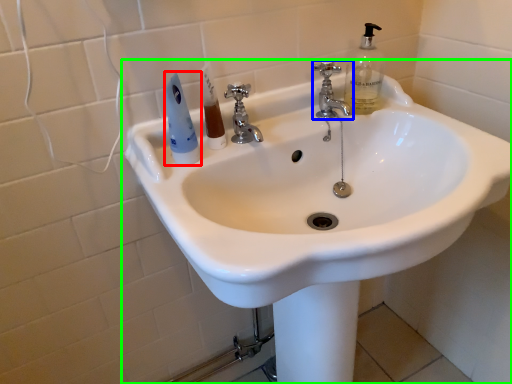
Question: Estimate the real-world distances between objects in this image. Which object is farther from mouthwash (highlighted by a red box), tap (highlighted by a blue box) or sink (highlighted by a green box)?

Choices:
 (A) tap
 (B) sink

Answer: (A)